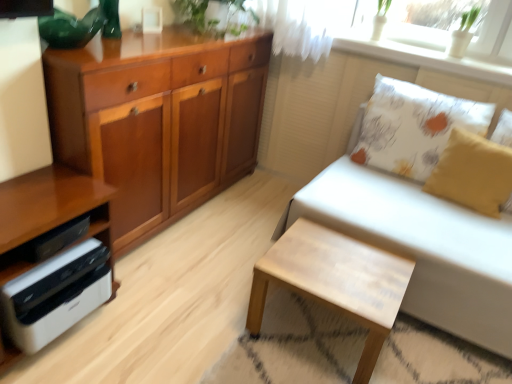
Question: Considering the relative positions of white textured cushion at upper right and green leafy plant at upper center in the image provided, is white textured cushion at upper right to the right of green leafy plant at upper center from the viewer's perspective?

Choices:
 (A) no
 (B) yes

Answer: (B)

Question: Is white textured cushion at upper right wider than green leafy plant at upper center?

Choices:
 (A) no
 (B) yes

Answer: (A)

Question: Is white textured cushion at upper right touching green leafy plant at upper center?

Choices:
 (A) yes
 (B) no

Answer: (B)

Question: Considering the relative sizes of white textured cushion at upper right and green leafy plant at upper center in the image provided, is white textured cushion at upper right taller than green leafy plant at upper center?

Choices:
 (A) yes
 (B) no

Answer: (B)

Question: Is white textured cushion at upper right further to camera compared to green leafy plant at upper center?

Choices:
 (A) no
 (B) yes

Answer: (B)

Question: From the image's perspective, is white textured cushion at upper right under green leafy plant at upper center?

Choices:
 (A) yes
 (B) no

Answer: (A)

Question: Is white leather stool at lower right outside of white printed cushion at upper right, the second pillow viewed from the front?

Choices:
 (A) no
 (B) yes

Answer: (B)

Question: From a real-world perspective, is white leather stool at lower right located beneath white printed cushion at upper right, the second pillow viewed from the front?

Choices:
 (A) no
 (B) yes

Answer: (B)

Question: Does white leather stool at lower right have a lesser height compared to white printed cushion at upper right, the second pillow viewed from the front?

Choices:
 (A) no
 (B) yes

Answer: (B)

Question: From the image's perspective, would you say white leather stool at lower right is shown under white printed cushion at upper right, positioned as the 1th pillow in back-to-front order?

Choices:
 (A) no
 (B) yes

Answer: (B)

Question: Considering the relative positions of white leather stool at lower right and white printed cushion at upper right, the second pillow viewed from the front, in the image provided, is white leather stool at lower right behind white printed cushion at upper right, the second pillow viewed from the front,?

Choices:
 (A) yes
 (B) no

Answer: (B)

Question: Is white printed cushion at upper right, the second pillow viewed from the front, located within white leather stool at lower right?

Choices:
 (A) no
 (B) yes

Answer: (A)

Question: Does green leafy plant at upper center have a smaller size compared to white printed cushion at upper right, the second pillow viewed from the front?

Choices:
 (A) no
 (B) yes

Answer: (B)